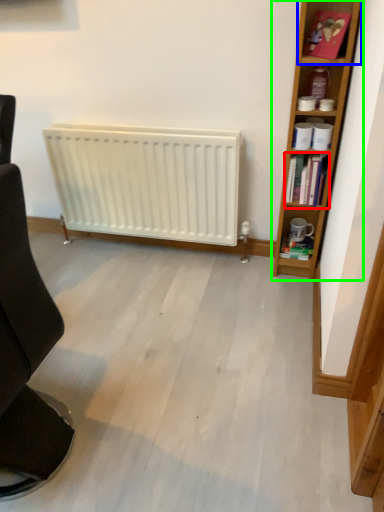
Question: Based on their relative distances, which object is farther from book (highlighted by a red box)? Choose from cabinet (highlighted by a blue box) and bookcase (highlighted by a green box).

Choices:
 (A) cabinet
 (B) bookcase

Answer: (A)